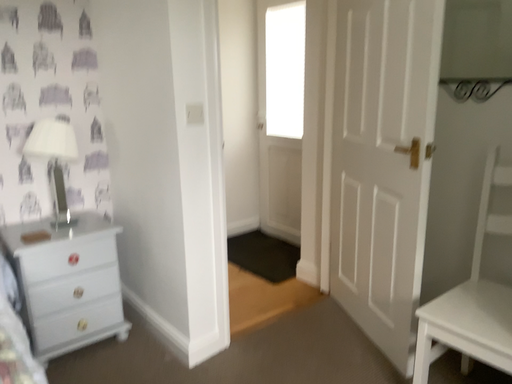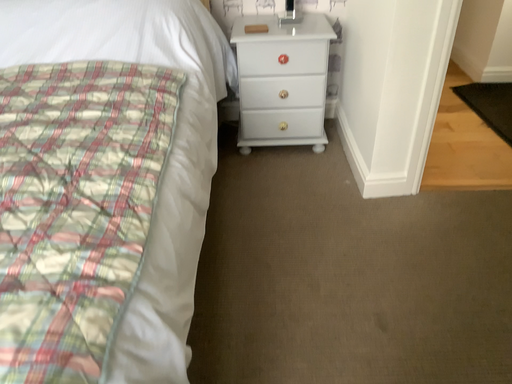
Question: How did the camera likely rotate when shooting the video?

Choices:
 (A) rotated downward
 (B) rotated upward

Answer: (A)